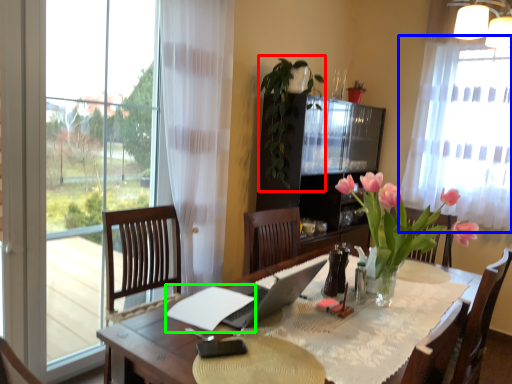
Question: Estimate the real-world distances between objects in this image. Which object is farther from plant (highlighted by a red box), curtain (highlighted by a blue box) or notepad (highlighted by a green box)?

Choices:
 (A) curtain
 (B) notepad

Answer: (B)